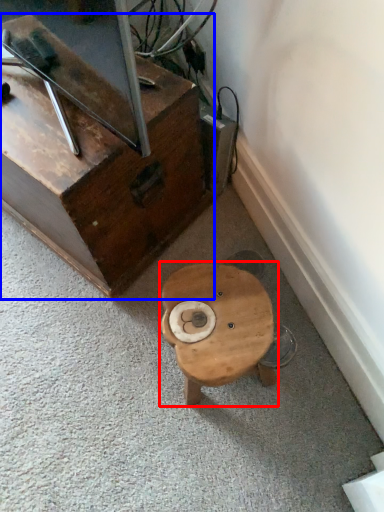
Question: Which object appears farthest to the camera in this image, table (highlighted by a red box) or furniture (highlighted by a blue box)?

Choices:
 (A) table
 (B) furniture

Answer: (B)